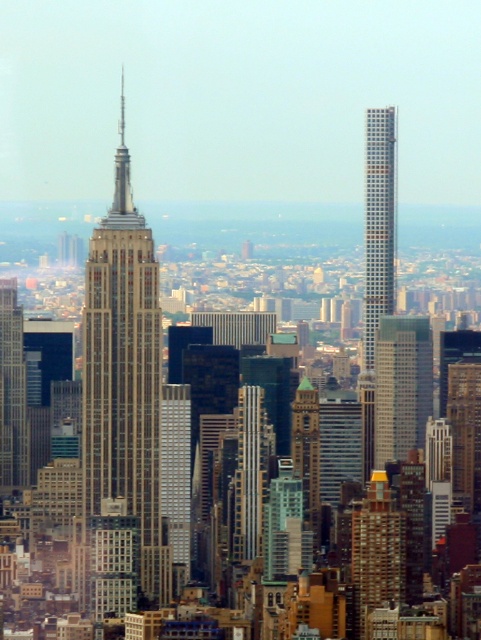
Does glassy reflective skyscraper at center have a greater height compared to matte glass skyscraper at center-left?

Incorrect, glassy reflective skyscraper at center's height is not larger of matte glass skyscraper at center-left's.

Is glassy reflective skyscraper at center positioned in front of matte glass skyscraper at center-left?

Yes.

Is point (383, 445) behind point (24, 426)?

No, it is in front of (24, 426).

This screenshot has width=481, height=640. I want to click on glassy reflective skyscraper at center, so click(x=402, y=387).

Between glassy reflective skyscraper at center and brick textured building at center, which one has less height?

glassy reflective skyscraper at center is shorter.

Does glassy reflective skyscraper at center lie in front of brick textured building at center?

Yes.

The height and width of the screenshot is (640, 481). Find the location of `glassy reflective skyscraper at center`. glassy reflective skyscraper at center is located at coordinates (402, 387).

The width and height of the screenshot is (481, 640). I want to click on glassy reflective skyscraper at center, so click(402, 387).

Does silver metallic skyscraper at upper right have a greater width compared to brick textured building at center?

No.

Locate an element on the screen. This screenshot has height=640, width=481. silver metallic skyscraper at upper right is located at coordinates (379, 224).

The width and height of the screenshot is (481, 640). In order to click on silver metallic skyscraper at upper right in this screenshot , I will do `click(379, 224)`.